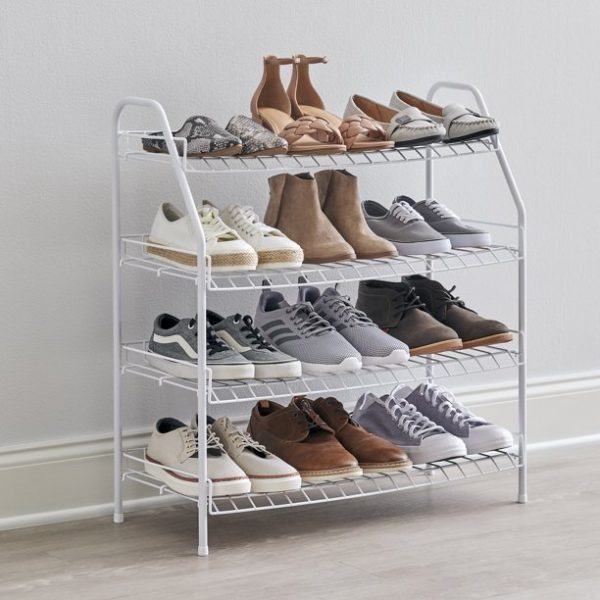
The height and width of the screenshot is (600, 600). I want to click on shoes on top shelf, so click(x=454, y=120), click(x=410, y=135), click(x=358, y=137), click(x=317, y=148), click(x=251, y=142), click(x=216, y=141).